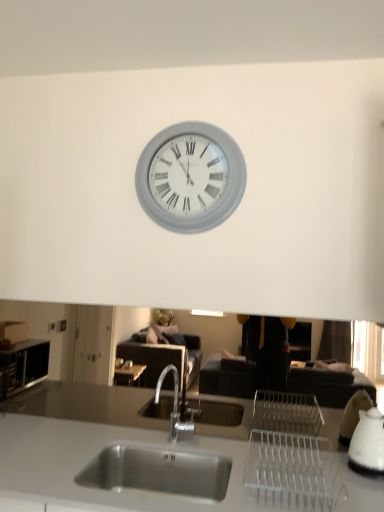
Question: Is stainless steel sink at center closer to camera compared to gray matte clock at upper center?

Choices:
 (A) no
 (B) yes

Answer: (B)

Question: Can you confirm if stainless steel sink at center is bigger than gray matte clock at upper center?

Choices:
 (A) yes
 (B) no

Answer: (A)

Question: From the image's perspective, is stainless steel sink at center over gray matte clock at upper center?

Choices:
 (A) no
 (B) yes

Answer: (A)

Question: Considering the relative positions of stainless steel sink at center and gray matte clock at upper center in the image provided, is stainless steel sink at center behind gray matte clock at upper center?

Choices:
 (A) no
 (B) yes

Answer: (A)

Question: Considering the relative positions of stainless steel sink at center and gray matte clock at upper center in the image provided, is stainless steel sink at center to the right of gray matte clock at upper center from the viewer's perspective?

Choices:
 (A) yes
 (B) no

Answer: (B)

Question: Is stainless steel sink at center wider than gray matte clock at upper center?

Choices:
 (A) yes
 (B) no

Answer: (A)

Question: Are gray matte clock at upper center and stainless steel sink at center far apart?

Choices:
 (A) yes
 (B) no

Answer: (A)

Question: From a real-world perspective, is gray matte clock at upper center positioned under stainless steel sink at center based on gravity?

Choices:
 (A) yes
 (B) no

Answer: (B)

Question: From a real-world perspective, is gray matte clock at upper center physically above stainless steel sink at center?

Choices:
 (A) yes
 (B) no

Answer: (A)

Question: Is gray matte clock at upper center looking in the opposite direction of stainless steel sink at center?

Choices:
 (A) yes
 (B) no

Answer: (B)

Question: Is gray matte clock at upper center in contact with stainless steel sink at center?

Choices:
 (A) no
 (B) yes

Answer: (A)

Question: Would you say stainless steel sink at center is part of gray matte clock at upper center's contents?

Choices:
 (A) yes
 (B) no

Answer: (B)

Question: From the image's perspective, does white glossy kettle at right appear higher than stainless steel sink at center?

Choices:
 (A) no
 (B) yes

Answer: (B)